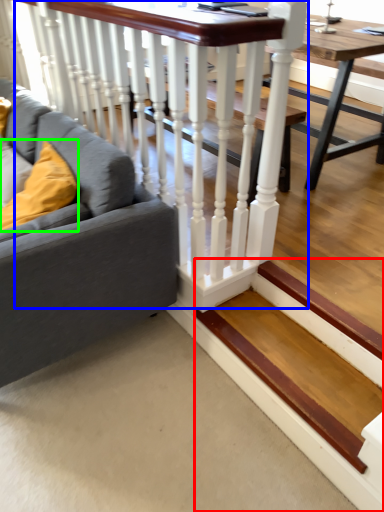
Question: Which object is the closest to the stairs (highlighted by a red box)? Choose among these: rail (highlighted by a blue box) or pillow (highlighted by a green box).

Choices:
 (A) rail
 (B) pillow

Answer: (A)